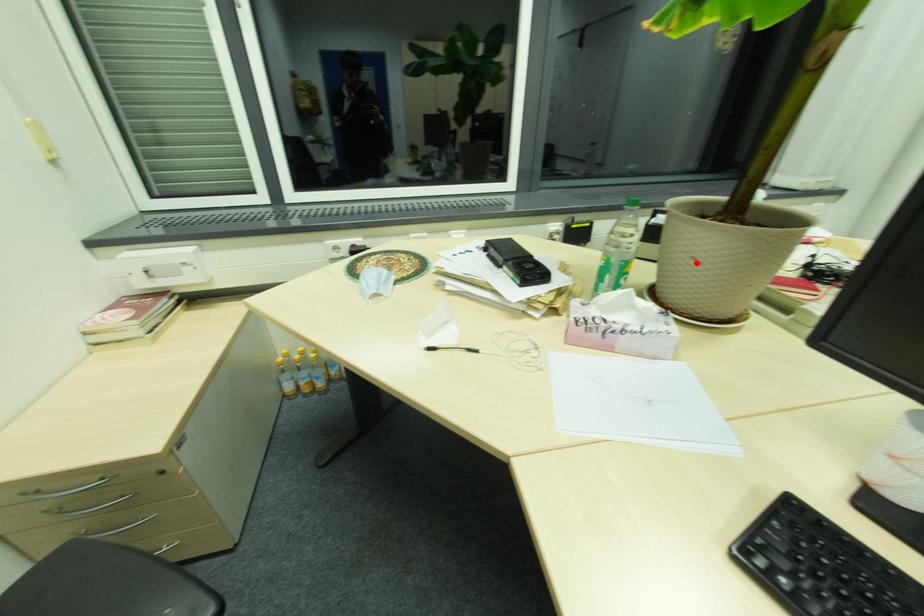
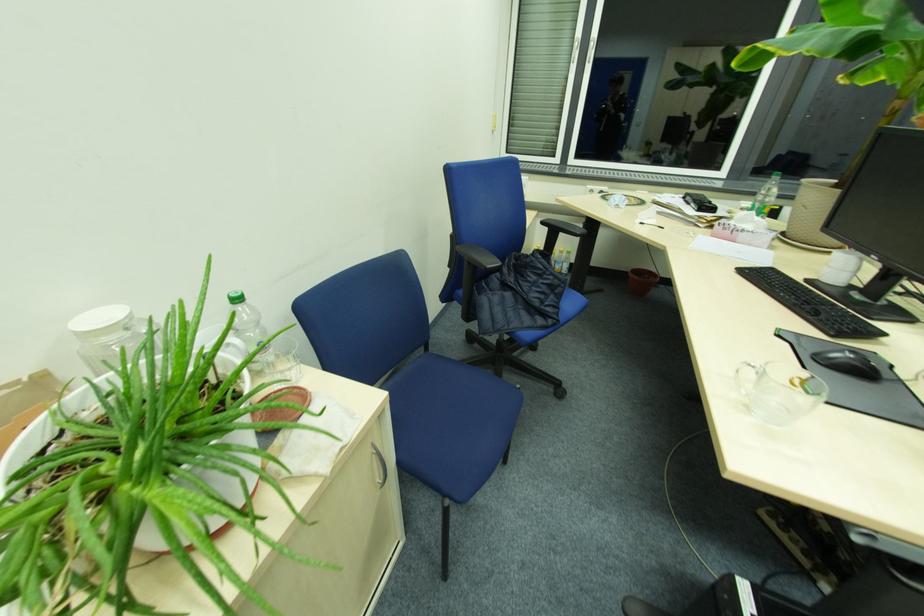
Question: I am providing you with two images of the same scene from different viewpoints. In image1, a red point is highlighted. Considering the same 3D point in image2, which of the following is correct?

Choices:
 (A) It is closer
 (B) It is farther

Answer: (B)